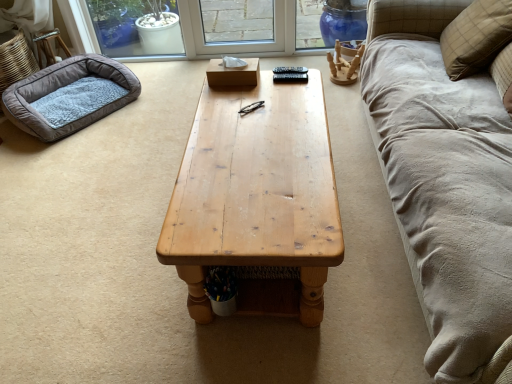
In order to click on empty space that is ontop of natural wood coffee table at center (from a real-world perspective) in this screenshot , I will do `click(257, 140)`.